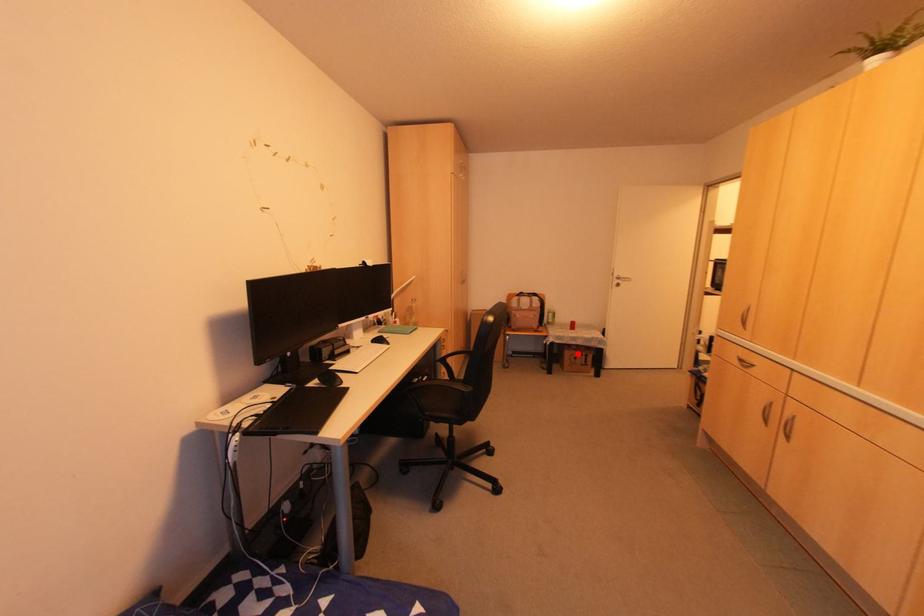
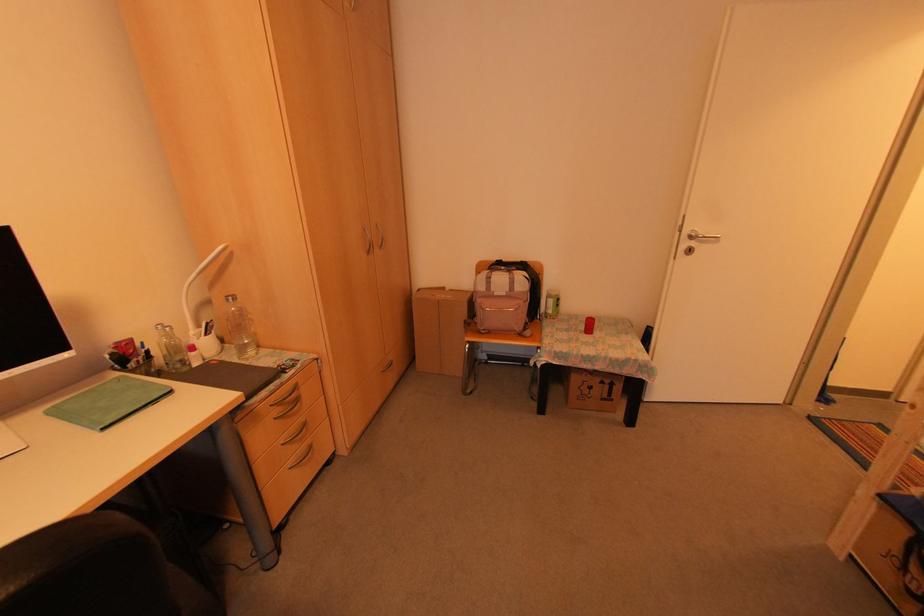
Question: I am providing you with two images of the same scene from different viewpoints. Image1 has a red point marked. In image2, the corresponding 3D location appears at what relative position? Reply with the corresponding letter.

Choices:
 (A) Closer
 (B) Farther

Answer: (A)